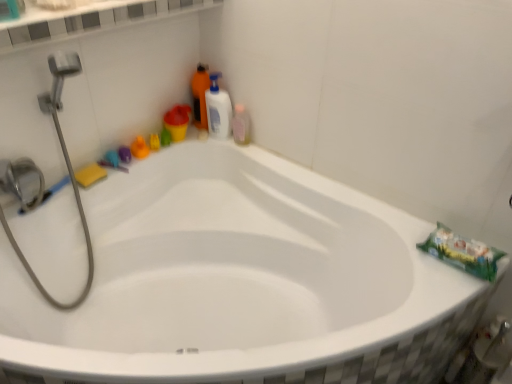
Question: Is there a large distance between white glossy bottle at upper right, the 1th cleaning product positioned from the right, and white glossy ledge at upper center?

Choices:
 (A) no
 (B) yes

Answer: (A)

Question: Does white glossy bottle at upper right, the 1th cleaning product positioned from the right, have a greater height compared to white glossy ledge at upper center?

Choices:
 (A) yes
 (B) no

Answer: (A)

Question: Does white glossy bottle at upper right, marked as the second cleaning product in a left-to-right arrangement, have a smaller size compared to white glossy ledge at upper center?

Choices:
 (A) no
 (B) yes

Answer: (B)

Question: Is white glossy bottle at upper right, the 1th cleaning product positioned from the right, further to camera compared to white glossy ledge at upper center?

Choices:
 (A) no
 (B) yes

Answer: (B)

Question: From a real-world perspective, is white glossy bottle at upper right, marked as the second cleaning product in a left-to-right arrangement, on white glossy ledge at upper center?

Choices:
 (A) yes
 (B) no

Answer: (B)

Question: In terms of size, does orange matte bottle at upper center, arranged as the 2th cleaning product when viewed from the right, appear bigger or smaller than white glossy ledge at upper center?

Choices:
 (A) small
 (B) big

Answer: (A)

Question: Considering the positions of orange matte bottle at upper center, arranged as the 2th cleaning product when viewed from the right, and white glossy ledge at upper center in the image, is orange matte bottle at upper center, arranged as the 2th cleaning product when viewed from the right, wider or thinner than white glossy ledge at upper center?

Choices:
 (A) wide
 (B) thin

Answer: (B)

Question: Would you say orange matte bottle at upper center, arranged as the 2th cleaning product when viewed from the right, is to the left or to the right of white glossy ledge at upper center in the picture?

Choices:
 (A) right
 (B) left

Answer: (A)

Question: From the image's perspective, is orange matte bottle at upper center, which is the 1th cleaning product in left-to-right order, located above or below white glossy ledge at upper center?

Choices:
 (A) above
 (B) below

Answer: (B)

Question: Would you say orange matte bottle at upper center, arranged as the 2th cleaning product when viewed from the right, is to the left or to the right of pink translucent bottle at upper right in the picture?

Choices:
 (A) left
 (B) right

Answer: (A)

Question: Does point (197, 84) appear closer or farther from the camera than point (236, 117)?

Choices:
 (A) farther
 (B) closer

Answer: (A)

Question: From the image's perspective, is orange matte bottle at upper center, which is the 1th cleaning product in left-to-right order, positioned above or below pink translucent bottle at upper right?

Choices:
 (A) above
 (B) below

Answer: (A)

Question: Considering the positions of orange matte bottle at upper center, which is the 1th cleaning product in left-to-right order, and pink translucent bottle at upper right in the image, is orange matte bottle at upper center, which is the 1th cleaning product in left-to-right order, wider or thinner than pink translucent bottle at upper right?

Choices:
 (A) thin
 (B) wide

Answer: (B)

Question: In terms of size, does white glossy ledge at upper center appear bigger or smaller than orange matte bottle at upper center, arranged as the 2th cleaning product when viewed from the right?

Choices:
 (A) big
 (B) small

Answer: (A)

Question: Does point (169, 14) appear closer or farther from the camera than point (201, 119)?

Choices:
 (A) closer
 (B) farther

Answer: (A)